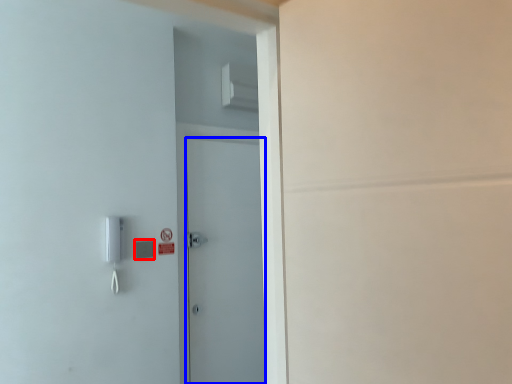
Question: Which of the following is the closest to the observer, light switch (highlighted by a red box) or door (highlighted by a blue box)?

Choices:
 (A) light switch
 (B) door

Answer: (A)